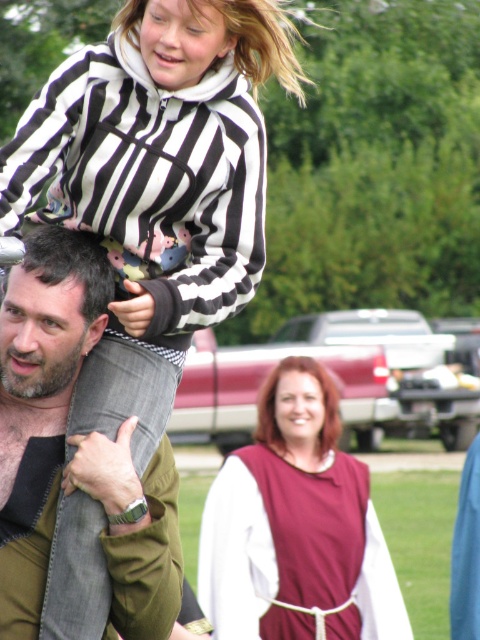
You are a fashion designer observing the scene. You need to decide which clothing item, the matte burgundy tunic at center or the striped fleece at upper center, would be more suitable for a design that requires a wider silhouette. Based on the scene, which one should you choose?

The striped fleece at upper center has a greater width than the matte burgundy tunic at center, so it would be more suitable for a design requiring a wider silhouette.

You are a photographer standing at the scene. You want to take a photo of the matte burgundy tunic at center and the striped fleece at upper center. The minimum distance between the two items in the photo should be 4 meters. Can you capture them in a single frame?

The matte burgundy tunic at center is 4.24 meters from the striped fleece at upper center, so yes, you can capture them in a single frame as the distance is more than 4 meters.

You are a photographer trying to capture a candid shot of the scene. You notice the denim jeans at upper left and the smooth burgundy fabric at center. Which object should you focus on first to ensure both are in focus, considering their positions?

You should focus on the denim jeans at upper left first because it is closer to the viewer than the smooth burgundy fabric at center, so adjusting focus from near to far will help both be in focus.